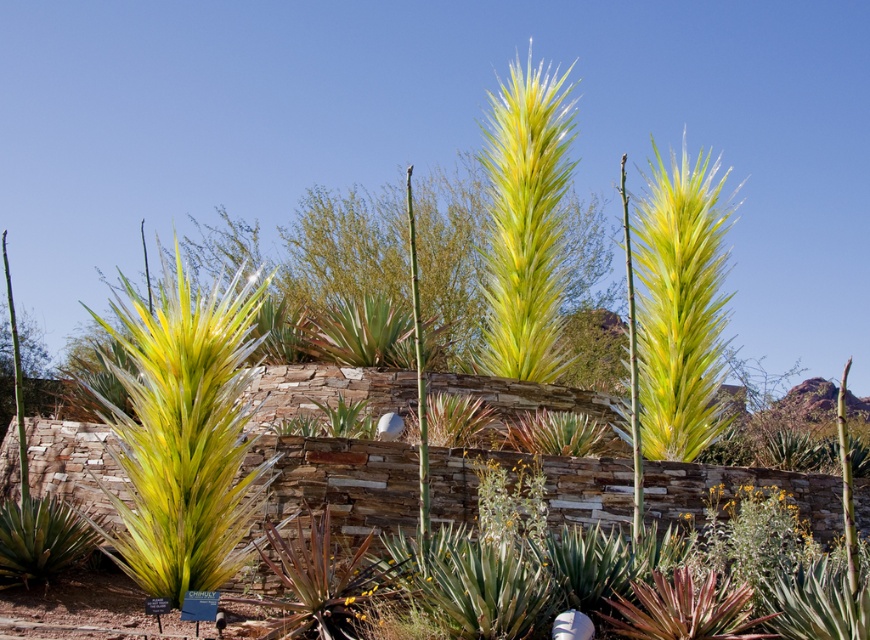
Is point (42, 520) positioned before point (766, 515)?

That is False.

Is translucent yellow glass plant at lower left thinner than yellow-green glass flower at center?

Yes.

Is point (18, 564) farther from camera compared to point (708, 525)?

No, (18, 564) is closer to viewer.

Image resolution: width=870 pixels, height=640 pixels. I want to click on translucent yellow glass plant at lower left, so click(39, 540).